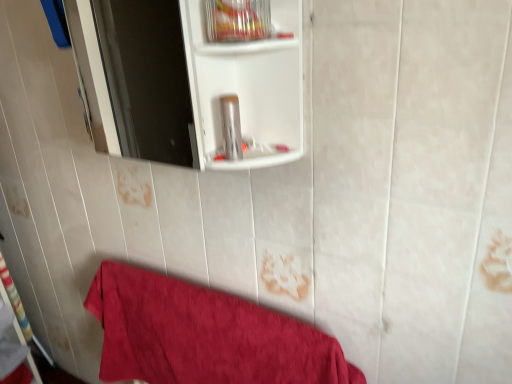
Question: Is silver metallic canister at center not within clear plastic container at upper center?

Choices:
 (A) yes
 (B) no

Answer: (A)

Question: Is silver metallic canister at center directly adjacent to clear plastic container at upper center?

Choices:
 (A) yes
 (B) no

Answer: (B)

Question: From a real-world perspective, is silver metallic canister at center on clear plastic container at upper center?

Choices:
 (A) no
 (B) yes

Answer: (A)

Question: Can you confirm if silver metallic canister at center is thinner than clear plastic container at upper center?

Choices:
 (A) no
 (B) yes

Answer: (B)

Question: From the image's perspective, does silver metallic canister at center appear higher than clear plastic container at upper center?

Choices:
 (A) no
 (B) yes

Answer: (A)

Question: From a real-world perspective, is silver metallic canister at center physically below clear plastic container at upper center?

Choices:
 (A) yes
 (B) no

Answer: (A)

Question: From the image's perspective, is silver metallic canister at center beneath red cotton towel at lower left?

Choices:
 (A) yes
 (B) no

Answer: (B)

Question: Can you confirm if silver metallic canister at center is smaller than red cotton towel at lower left?

Choices:
 (A) no
 (B) yes

Answer: (B)

Question: From the image's perspective, is silver metallic canister at center above red cotton towel at lower left?

Choices:
 (A) no
 (B) yes

Answer: (B)

Question: Does silver metallic canister at center have a greater height compared to red cotton towel at lower left?

Choices:
 (A) no
 (B) yes

Answer: (A)

Question: Is silver metallic canister at center located outside red cotton towel at lower left?

Choices:
 (A) no
 (B) yes

Answer: (B)

Question: From a real-world perspective, is silver metallic canister at center on top of red cotton towel at lower left?

Choices:
 (A) no
 (B) yes

Answer: (B)

Question: Is red cotton towel at lower left not inside silver metallic canister at center?

Choices:
 (A) no
 (B) yes

Answer: (B)